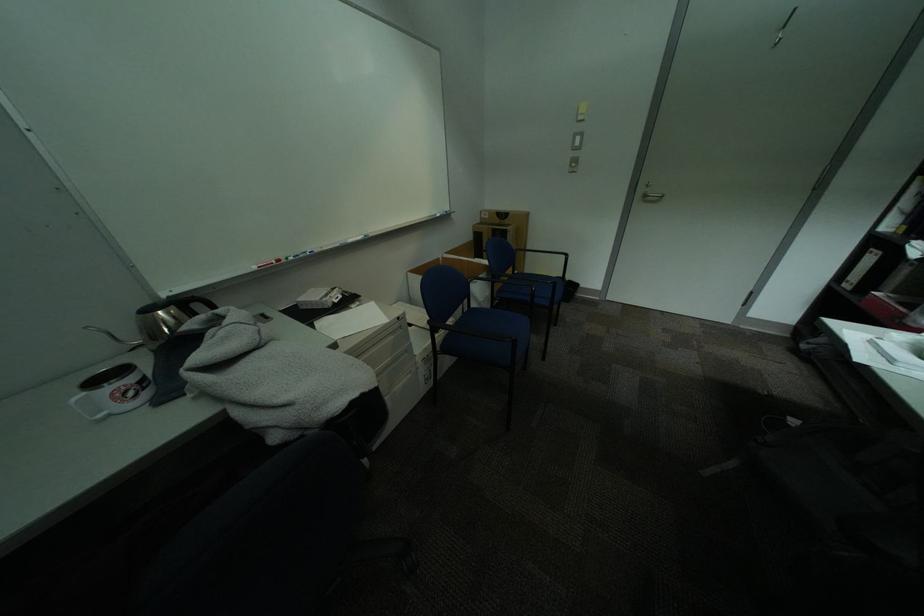
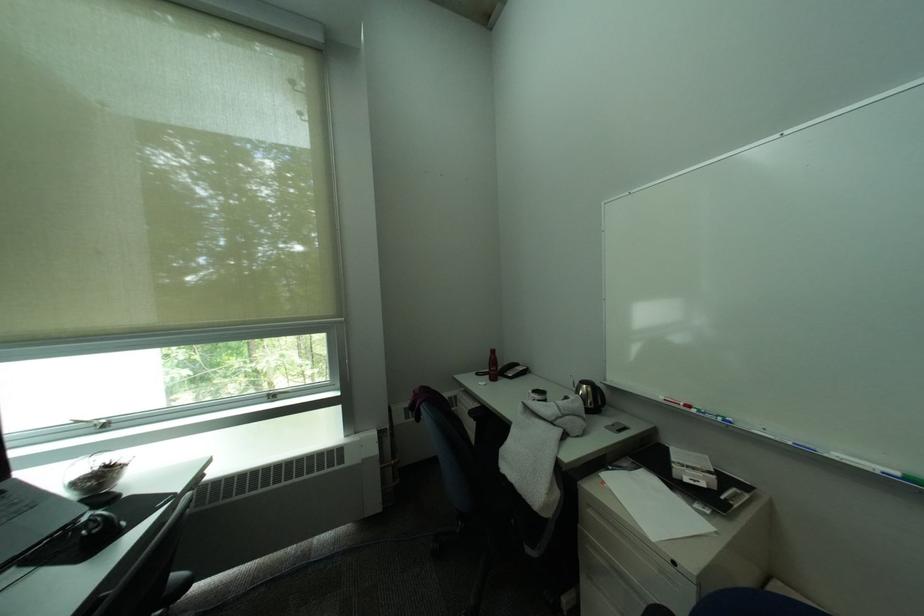
Where in the second image is the point corresponding to (312,257) from the first image?

(719, 416)